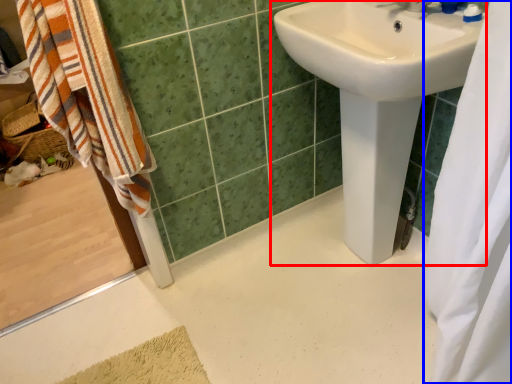
Question: Which object appears closest to the camera in this image, sink (highlighted by a red box) or shower curtain (highlighted by a blue box)?

Choices:
 (A) sink
 (B) shower curtain

Answer: (B)